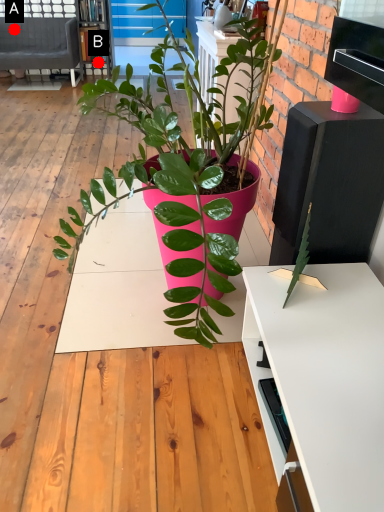
Question: Two points are circled on the image, labeled by A and B beside each circle. Which point is closer to the camera?

Choices:
 (A) A is closer
 (B) B is closer

Answer: (B)